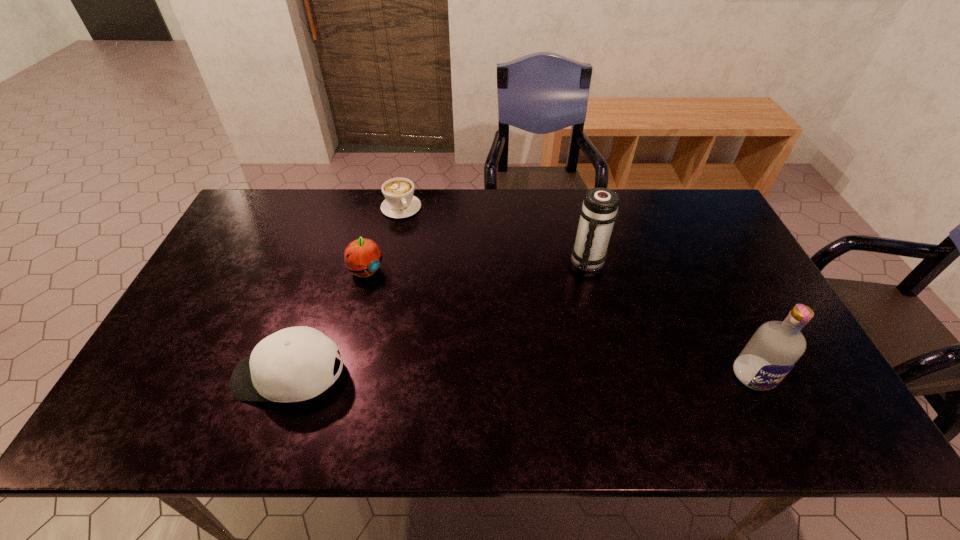
Where is `vodka present at the near edge`? Image resolution: width=960 pixels, height=540 pixels. vodka present at the near edge is located at coordinates (776, 347).

Where is `object at the right edge`? This screenshot has width=960, height=540. object at the right edge is located at coordinates (776, 347).

Where is `object at the near right corner`? This screenshot has height=540, width=960. object at the near right corner is located at coordinates (776, 347).

You are a GUI agent. You are given a task and a screenshot of the screen. Output one action in this format:
    pyautogui.click(x=<x>, y=<y>)
    Task: Click on the vacant space at the far edge
    The image size is (960, 540).
    Given the screenshot: What is the action you would take?
    pyautogui.click(x=491, y=215)

At what (x,y) coordinates should I click in order to perform the action: click on vacant space at the near edge of the desktop. Please return your answer as a coordinate pair (x, y). This screenshot has height=540, width=960. Looking at the image, I should click on (713, 380).

What are the coordinates of `vacant position at the left edge of the desktop` in the screenshot? It's located at (217, 293).

Find the location of `free location at the right edge`. free location at the right edge is located at coordinates pos(751,280).

Where is `free region at the far left corner`? The width and height of the screenshot is (960, 540). free region at the far left corner is located at coordinates (285, 201).

In order to click on vacant region at the far right corner in this screenshot , I will do `click(705, 195)`.

This screenshot has height=540, width=960. I want to click on free point between the fourth object from left to right and the baseball cap, so click(x=439, y=319).